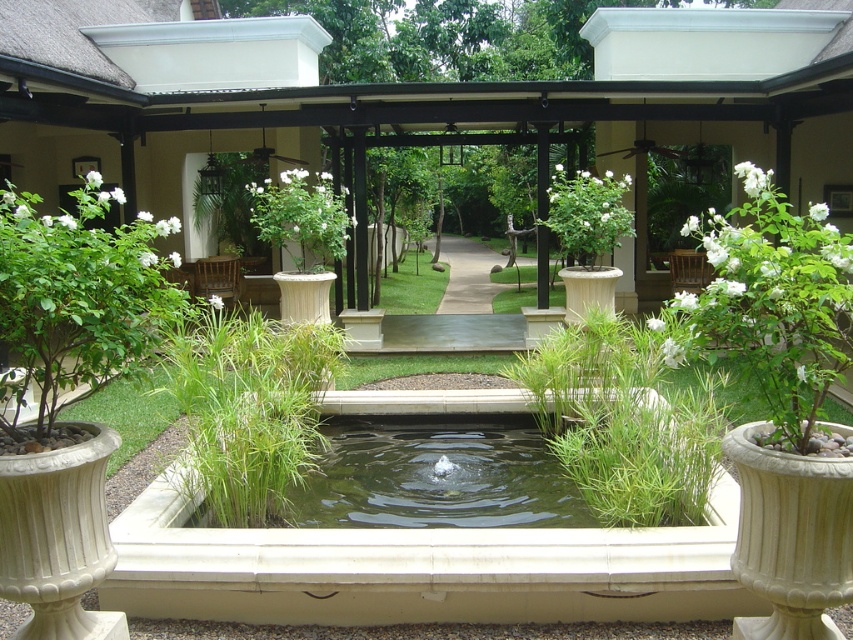
Which is behind, point (554, 336) or point (792, 330)?

The point (554, 336) is more distant.

Can you confirm if green grass at center is bigger than white matte plant at right?

Yes, green grass at center is bigger than white matte plant at right.

You are a GUI agent. You are given a task and a screenshot of the screen. Output one action in this format:
    pyautogui.click(x=<x>, y=<y>)
    Task: Click on the green grass at center
    The width and height of the screenshot is (853, 640).
    Given the screenshot: What is the action you would take?
    pyautogui.click(x=624, y=420)

At what (x,y) coordinates should I click in order to perform the action: click on green grass at center. Please return your answer as a coordinate pair (x, y). Looking at the image, I should click on (624, 420).

Can you confirm if green textured pergola at center is positioned to the left of white matte plant at right?

Correct, you'll find green textured pergola at center to the left of white matte plant at right.

Can you confirm if green textured pergola at center is thinner than white matte plant at right?

In fact, green textured pergola at center might be wider than white matte plant at right.

What do you see at coordinates (422, 115) in the screenshot? The height and width of the screenshot is (640, 853). I see `green textured pergola at center` at bounding box center [422, 115].

Find the location of `green textured pergola at center`. green textured pergola at center is located at coordinates (422, 115).

Is point (784, 304) behind point (281, 196)?

No, it is not.

Based on the photo, between white matte plant at right and white glossy vase at center, which one appears on the left side from the viewer's perspective?

white glossy vase at center is more to the left.

Which is in front, point (767, 394) or point (351, 220)?

Point (767, 394) is in front.

The width and height of the screenshot is (853, 640). What are the coordinates of `white matte plant at right` in the screenshot? It's located at (775, 301).